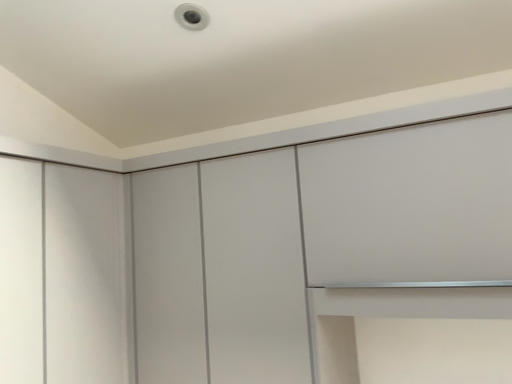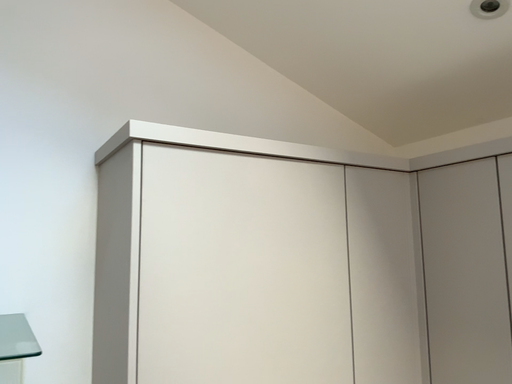
Question: How did the camera likely rotate when shooting the video?

Choices:
 (A) rotated left
 (B) rotated right

Answer: (A)